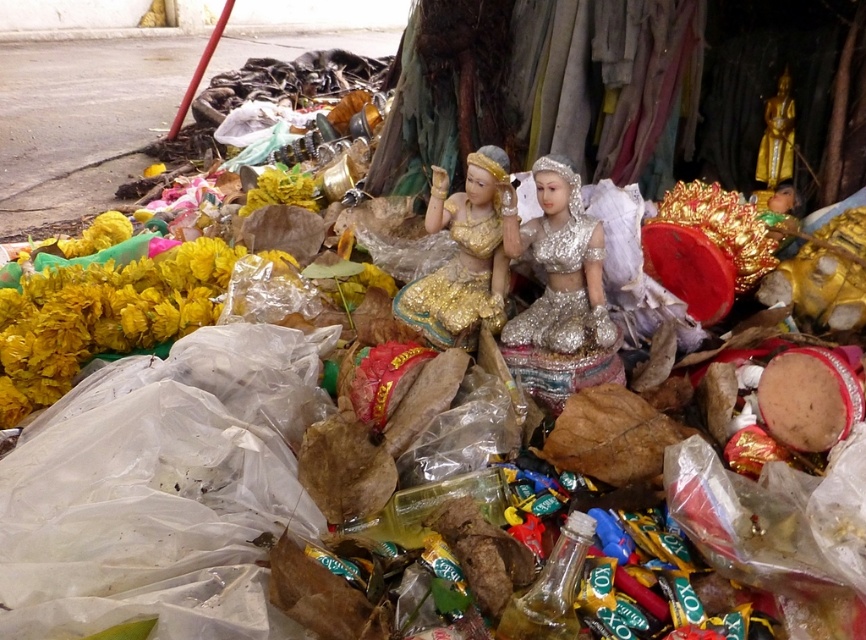
You are an art curator inspecting a collection of artifacts. You notice the silver glittering doll at center and the gold metallic statue at upper right. Which of these two items is taller?

The silver glittering doll at center is much taller than the gold metallic statue at upper right.